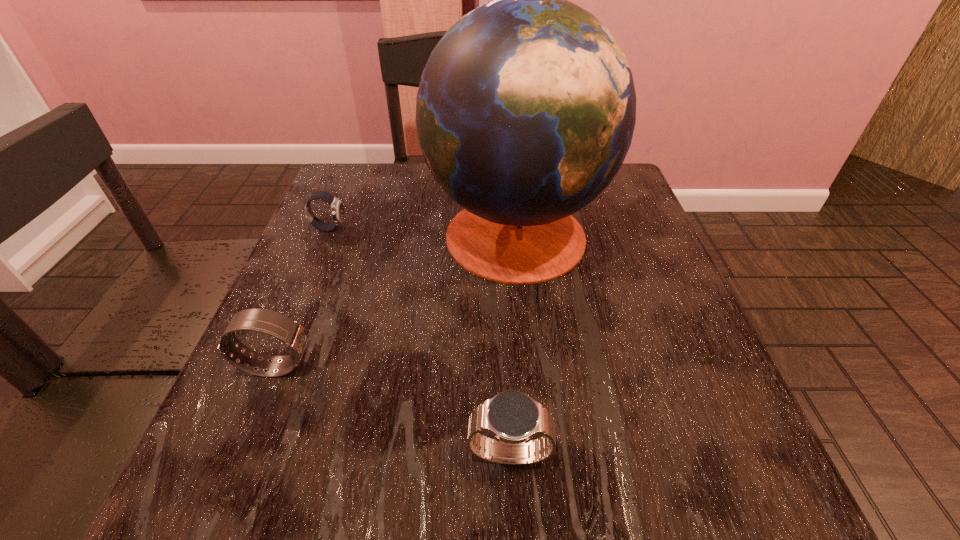
At what (x,y) coordinates should I click in order to perform the action: click on globe. Please return your answer as a coordinate pair (x, y). Looking at the image, I should click on (526, 108).

Image resolution: width=960 pixels, height=540 pixels. In order to click on the second nearest watch in this screenshot , I will do `click(293, 334)`.

The height and width of the screenshot is (540, 960). In order to click on the nearest object in this screenshot , I will do `click(512, 417)`.

The height and width of the screenshot is (540, 960). I want to click on the nearest watch, so click(512, 417).

The image size is (960, 540). In order to click on the shortest object in this screenshot , I will do `click(337, 209)`.

What are the coordinates of `the farthest watch` in the screenshot? It's located at click(337, 209).

This screenshot has width=960, height=540. Find the location of `free space located with the Americas facing the viewer on the globe`. free space located with the Americas facing the viewer on the globe is located at coordinates (341, 232).

Where is `free space located 0.200m with the Americas facing the viewer on the globe`? Image resolution: width=960 pixels, height=540 pixels. free space located 0.200m with the Americas facing the viewer on the globe is located at coordinates (336, 232).

The width and height of the screenshot is (960, 540). Identify the location of vacant space located with the Americas facing the viewer on the globe. (350, 232).

At what (x,y) coordinates should I click in order to perform the action: click on vacant space situated 0.140m on the face of the third farthest object. Please return your answer as a coordinate pair (x, y). Looking at the image, I should click on (400, 366).